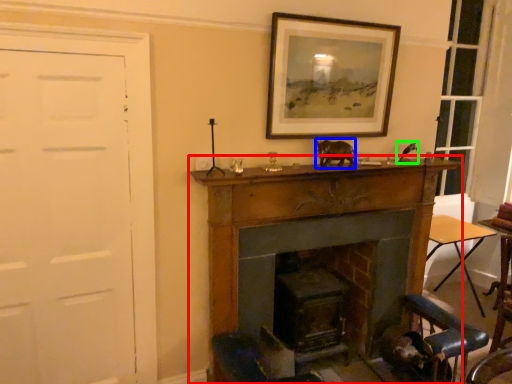
Question: Which object is the closest to the fireplace (highlighted by a red box)? Choose among these: animal (highlighted by a blue box) or animal (highlighted by a green box).

Choices:
 (A) animal
 (B) animal

Answer: (A)